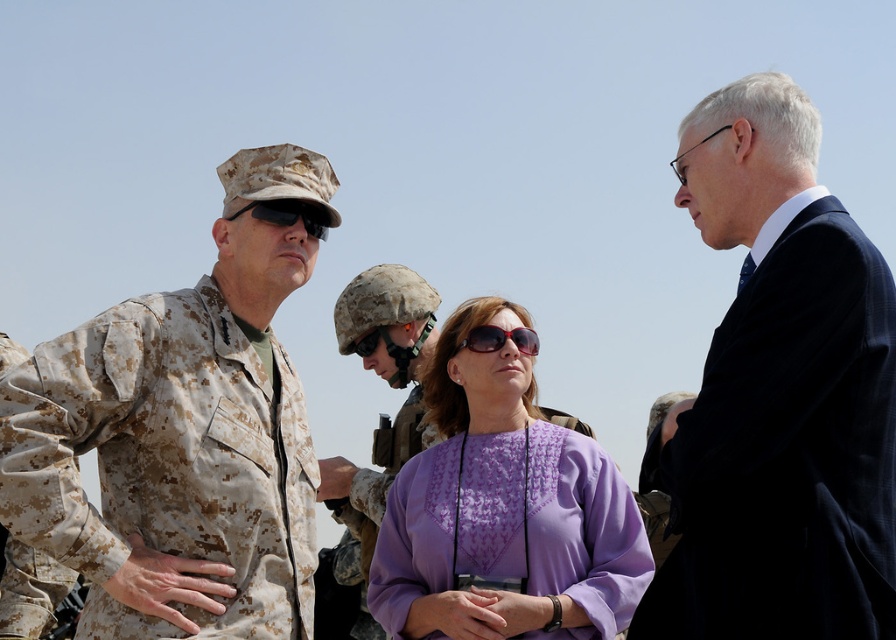
Can you confirm if camouflage uniform at center is positioned to the left of matte black sunglasses at upper center?

In fact, camouflage uniform at center is to the right of matte black sunglasses at upper center.

Describe the element at coordinates (380, 413) in the screenshot. This screenshot has height=640, width=896. I see `camouflage uniform at center` at that location.

Identify the location of camouflage uniform at center. (380, 413).

Which is behind, point (535, 508) or point (526, 353)?

Point (526, 353)

Is point (513, 515) farther from camera compared to point (479, 333)?

No, it is in front of (479, 333).

I want to click on purple fabric blouse at center, so click(x=504, y=509).

Between camouflage uniform at left and purple fabric blouse at center, which one appears on the right side from the viewer's perspective?

purple fabric blouse at center is more to the right.

Between camouflage uniform at left and purple fabric blouse at center, which one is positioned lower?

purple fabric blouse at center

Who is more forward, (196, 502) or (420, 592)?

Positioned in front is point (196, 502).

Find the location of a particular element. Image resolution: width=896 pixels, height=640 pixels. camouflage uniform at left is located at coordinates 181,435.